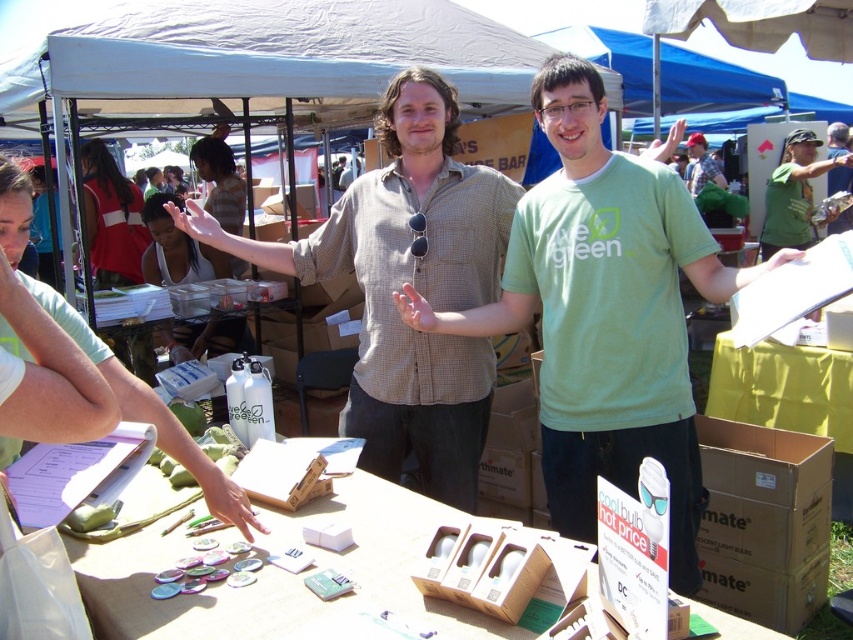
You are a customer at the market and want to approach both sellers wearing the light brown checkered shirt at center and green fabric shirt at center. If you start from the entrance, which seller should you approach first to minimize the distance walked?

You should approach the seller wearing the light brown checkered shirt at center first since it is closer to the entrance than the green fabric shirt at center.

In the scene shown: You are a customer at the market and want to place a small item in one of the two available spots. The brown cardboard box at lower right and the red fabric dress at upper left are both on the table. Which spot has more space available?

The red fabric dress at upper left has more space available because the brown cardboard box at lower right occupies less space than it.